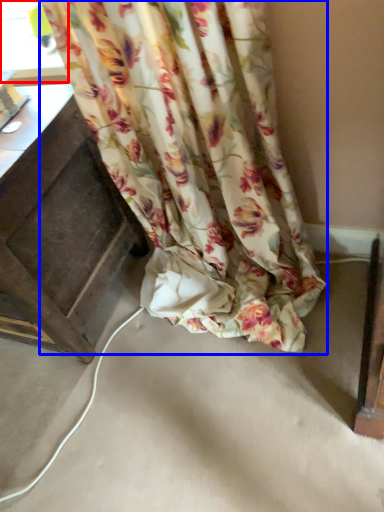
Question: Among these objects, which one is nearest to the camera, window (highlighted by a red box) or curtain (highlighted by a blue box)?

Choices:
 (A) window
 (B) curtain

Answer: (B)